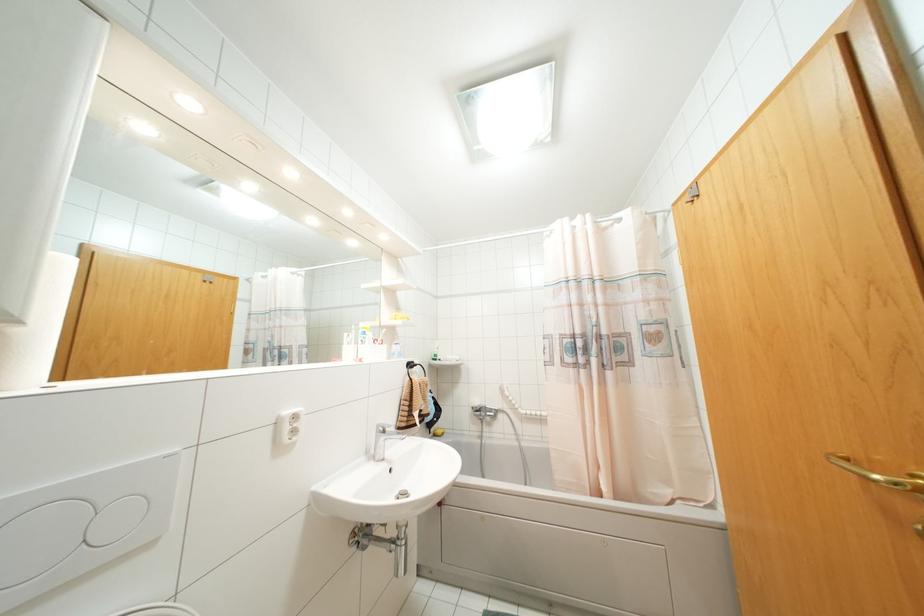
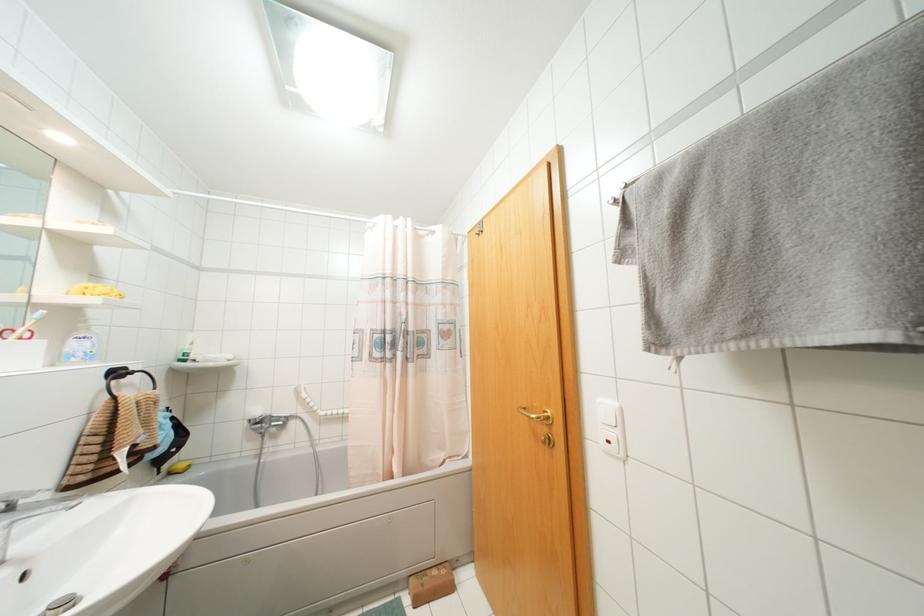
Locate, in the second image, the point that corresponds to point (388, 426) in the first image.

(30, 493)